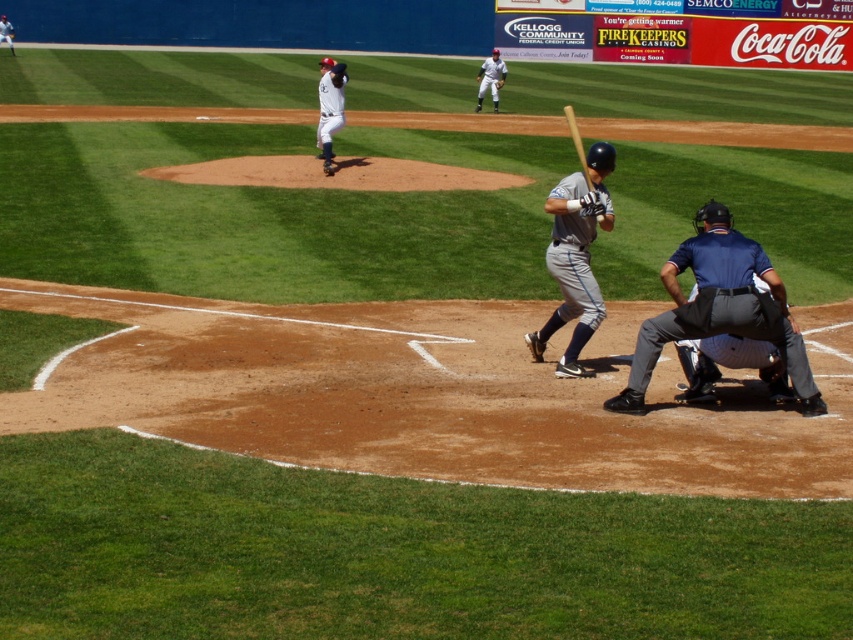
Does wooden baseball bat at center have a larger size compared to brown leather glove at lower center?

Indeed, wooden baseball bat at center has a larger size compared to brown leather glove at lower center.

Is wooden baseball bat at center shorter than brown leather glove at lower center?

Incorrect, wooden baseball bat at center's height does not fall short of brown leather glove at lower center's.

Does point (569, 109) come closer to viewer compared to point (598, 193)?

No, (569, 109) is further to viewer.

This screenshot has width=853, height=640. Find the location of `wooden baseball bat at center`. wooden baseball bat at center is located at coordinates [577, 144].

How distant is white uniform at upper center from brown leather glove at lower center?

white uniform at upper center is 24.94 meters away from brown leather glove at lower center.

What do you see at coordinates (490, 80) in the screenshot? This screenshot has height=640, width=853. I see `white uniform at upper center` at bounding box center [490, 80].

Is point (485, 76) positioned in front of point (596, 196)?

That is False.

At what (x,y) coordinates should I click in order to perform the action: click on white uniform at upper center. Please return your answer as a coordinate pair (x, y). Looking at the image, I should click on (490, 80).

Is white matte uniform at upper center closer to camera compared to gray uniformed player at center?

Yes, it is in front of gray uniformed player at center.

Can you confirm if white matte uniform at upper center is positioned below gray uniformed player at center?

Yes, white matte uniform at upper center is below gray uniformed player at center.

Is point (321, 86) less distant than point (1, 40)?

Yes, point (321, 86) is in front of point (1, 40).

This screenshot has height=640, width=853. What are the coordinates of `white matte uniform at upper center` in the screenshot? It's located at (329, 108).